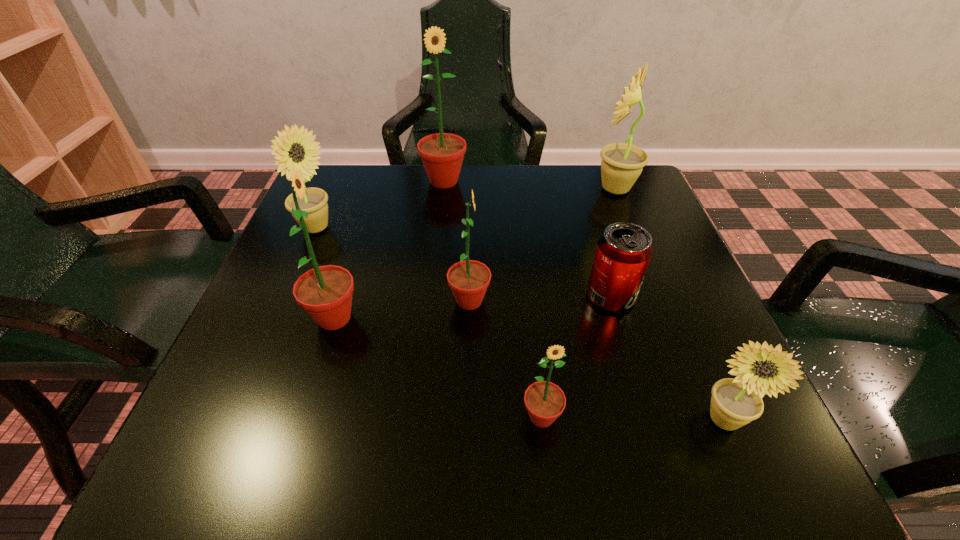
In order to click on soda can located at the right edge in this screenshot , I will do `click(623, 252)`.

Identify the location of object that is at the far left corner. This screenshot has width=960, height=540. (289, 152).

This screenshot has height=540, width=960. I want to click on object present at the far right corner, so click(x=621, y=165).

Where is `object that is at the near right corner`? This screenshot has height=540, width=960. object that is at the near right corner is located at coordinates (735, 402).

Identify the location of free location at the far edge of the desktop. (468, 192).

Find the location of `vacant space at the near edge of the desktop`. vacant space at the near edge of the desktop is located at coordinates (502, 443).

In the image, there is a desktop. Where is `vacant space at the left edge`? Image resolution: width=960 pixels, height=540 pixels. vacant space at the left edge is located at coordinates (296, 344).

At what (x,y) coordinates should I click in order to perform the action: click on free region at the right edge of the desktop. Please return your answer as a coordinate pair (x, y). Looking at the image, I should click on (641, 362).

Find the location of a particular element. free region at the far left corner of the desktop is located at coordinates (332, 195).

Locate an element on the screen. This screenshot has height=540, width=960. free space at the near left corner of the desktop is located at coordinates (283, 441).